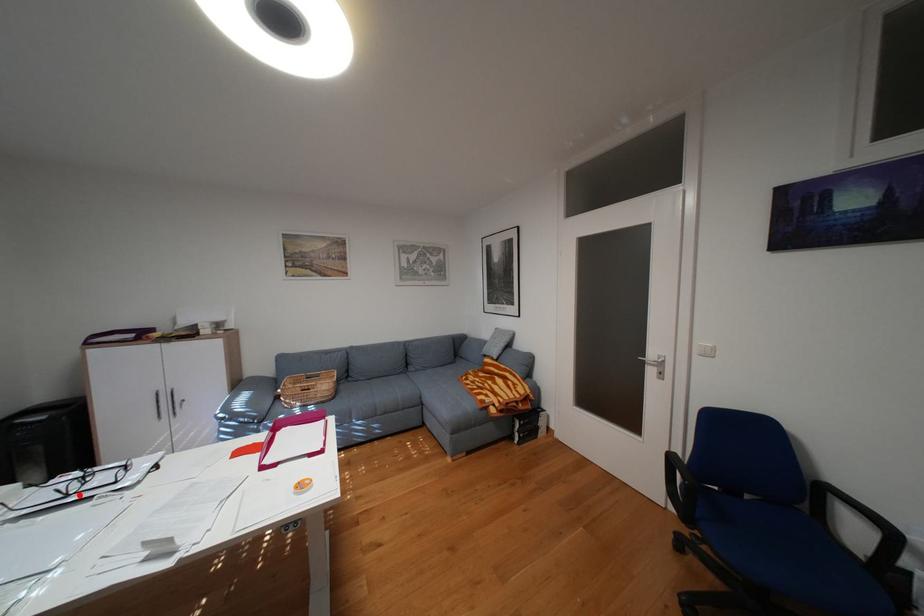
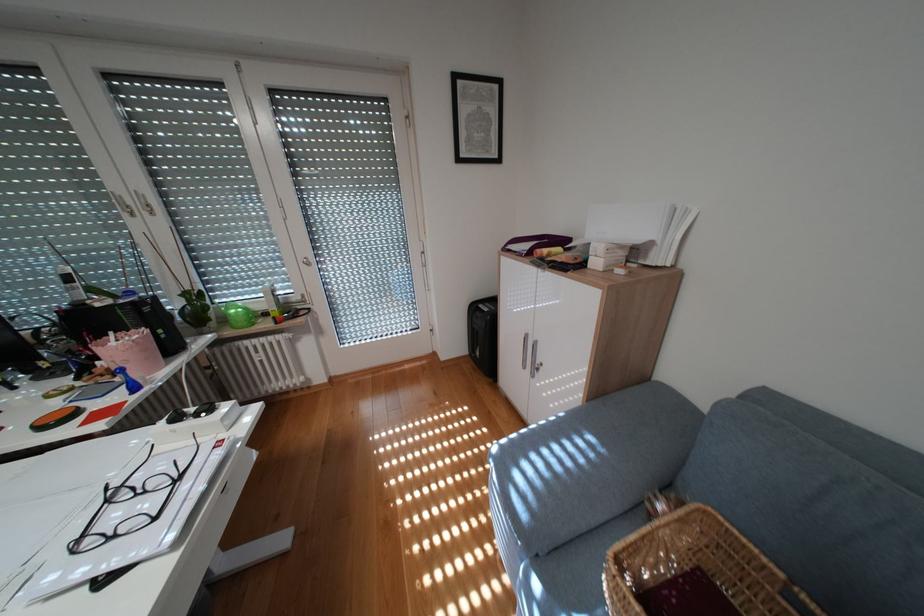
In the second image, find the point that corresponds to the highlighted location in the first image.

(119, 501)